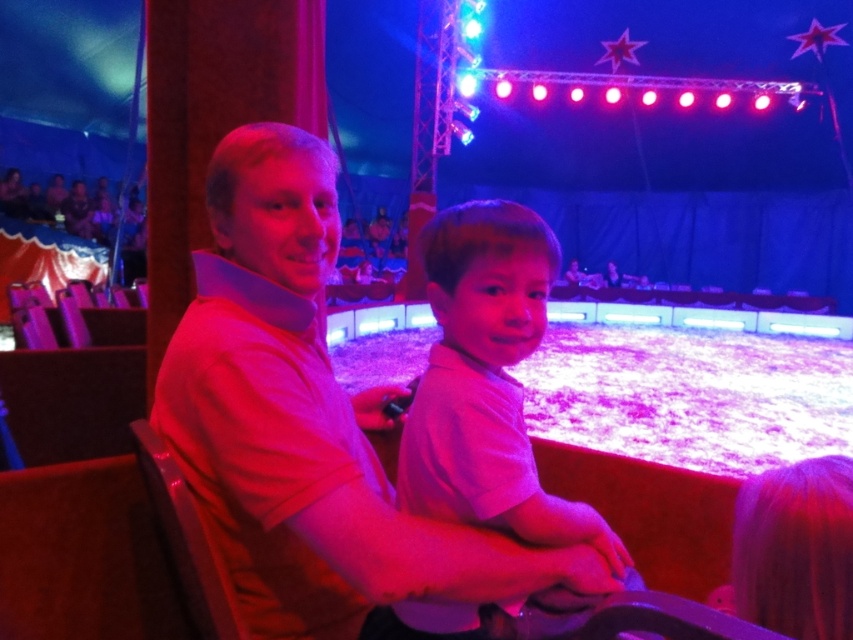
Question: Which point is farther from the camera taking this photo?

Choices:
 (A) (228, 164)
 (B) (469, 218)

Answer: (A)

Question: Does matte pink shirt at center have a larger size compared to pink cotton shirt at center?

Choices:
 (A) yes
 (B) no

Answer: (A)

Question: Which of the following is the farthest from the observer?

Choices:
 (A) (482, 291)
 (B) (263, 433)

Answer: (A)

Question: Is matte pink shirt at center smaller than pink cotton shirt at center?

Choices:
 (A) no
 (B) yes

Answer: (A)

Question: Is matte pink shirt at center smaller than pink cotton shirt at center?

Choices:
 (A) no
 (B) yes

Answer: (A)

Question: Which point is farther to the camera?

Choices:
 (A) matte pink shirt at center
 (B) pink cotton shirt at center

Answer: (B)